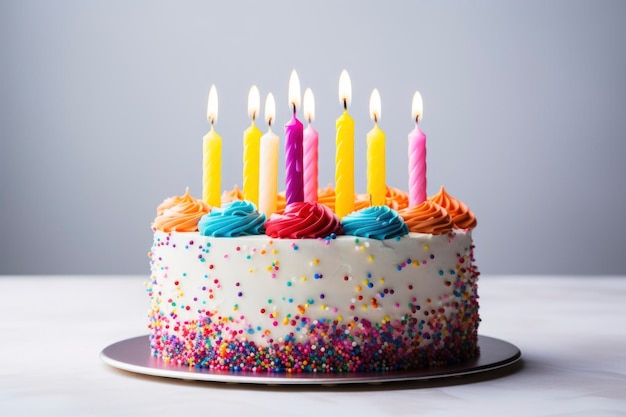
The height and width of the screenshot is (417, 626). In order to click on yellow candles in this screenshot , I will do `click(372, 153)`, `click(344, 168)`, `click(249, 161)`, `click(213, 171)`.